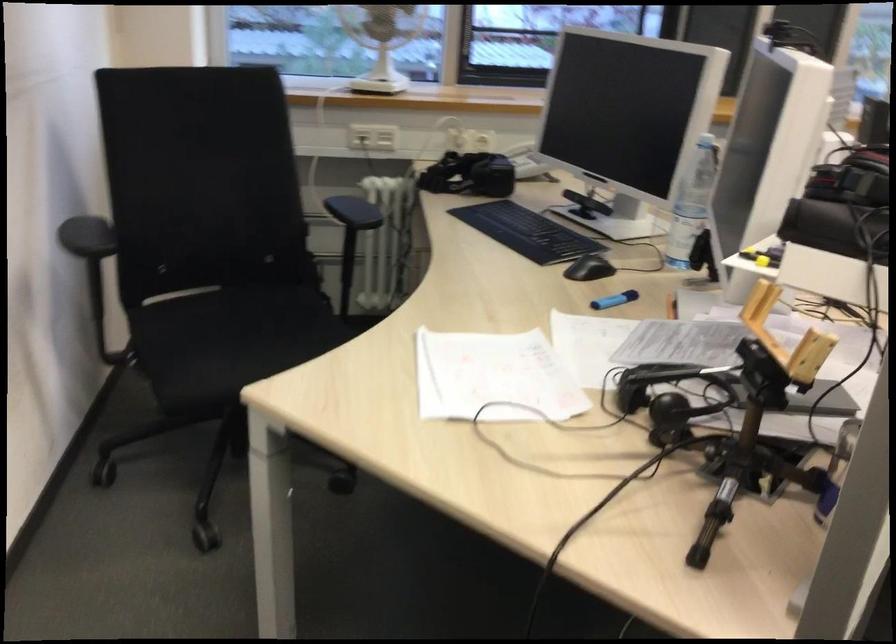
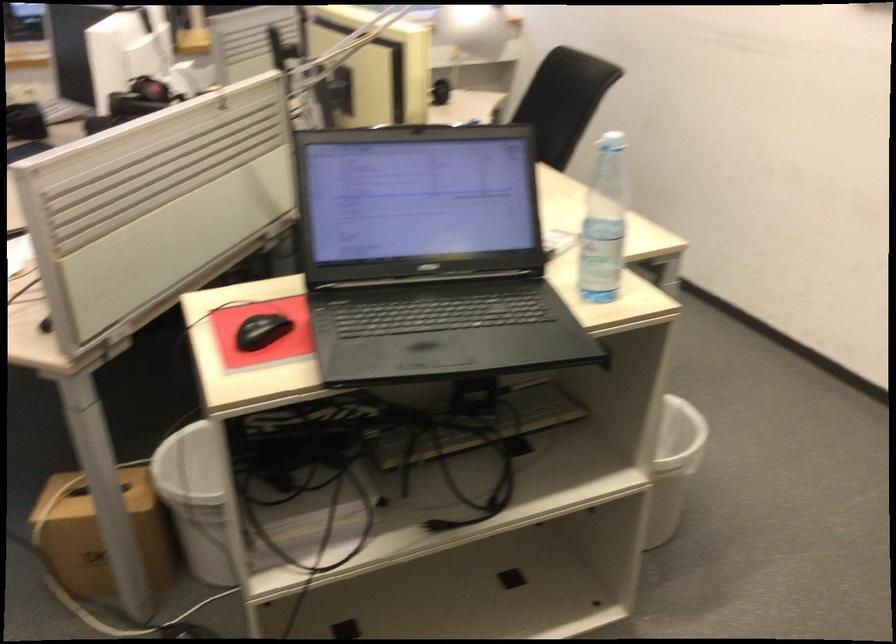
Question: I am providing you with two images of the same scene from different viewpoints. After the viewpoint changes to image2, which objects are now occluded?

Choices:
 (A) blue cap marker
 (B) black computer mouse
 (C) white trash can
 (D) television remote control

Answer: (A)